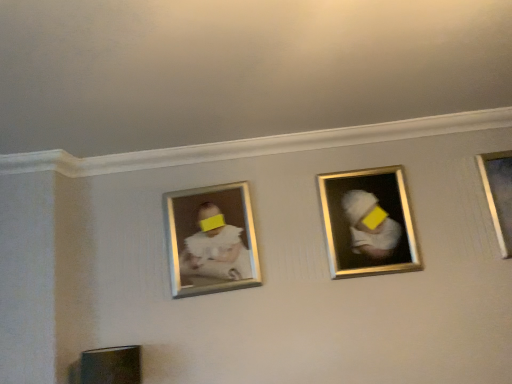
What is the approximate height of metallic silver picture frame at right, arranged as the second picture frame when viewed from the left?

23.09 inches.

What do you see at coordinates (215, 248) in the screenshot? This screenshot has height=384, width=512. I see `white matte baby portrait at center` at bounding box center [215, 248].

Identify the location of gold metallic picture frame at center, the 2th picture frame in the right-to-left sequence. (368, 222).

Can you see white matte baby portrait at center touching metallic silver picture frame at right, arranged as the second picture frame when viewed from the left?

No, white matte baby portrait at center is not beside metallic silver picture frame at right, arranged as the second picture frame when viewed from the left.

Is white matte baby portrait at center looking in the opposite direction of metallic silver picture frame at right, arranged as the second picture frame when viewed from the left?

No, metallic silver picture frame at right, arranged as the second picture frame when viewed from the left, is not at the back of white matte baby portrait at center.

Does white matte baby portrait at center have a smaller size compared to metallic silver picture frame at right, arranged as the second picture frame when viewed from the left?

No, white matte baby portrait at center is not smaller than metallic silver picture frame at right, arranged as the second picture frame when viewed from the left.

From a real-world perspective, relative to metallic silver picture frame at right, arranged as the second picture frame when viewed from the left, is white matte baby portrait at center vertically above or below?

From a real-world perspective, white matte baby portrait at center is physically above metallic silver picture frame at right, arranged as the second picture frame when viewed from the left.

From the image's perspective, which is below, gold metallic picture frame at center, the 2th picture frame in the right-to-left sequence, or metallic silver picture frame at right, arranged as the second picture frame when viewed from the left?

gold metallic picture frame at center, the 2th picture frame in the right-to-left sequence, is shown below in the image.

Consider the image. Considering the sizes of objects gold metallic picture frame at center, arranged as the 1th picture frame when viewed from the left, and metallic silver picture frame at right, arranged as the second picture frame when viewed from the left, in the image provided, who is wider, gold metallic picture frame at center, arranged as the 1th picture frame when viewed from the left, or metallic silver picture frame at right, arranged as the second picture frame when viewed from the left,?

Wider between the two is gold metallic picture frame at center, arranged as the 1th picture frame when viewed from the left.

From a real-world perspective, which object rests below the other?

gold metallic picture frame at center, the 2th picture frame in the right-to-left sequence, from a real-world perspective.

From a real-world perspective, between gold metallic picture frame at center, the 2th picture frame in the right-to-left sequence, and white matte baby portrait at center, who is vertically lower?

From a 3D spatial view, gold metallic picture frame at center, the 2th picture frame in the right-to-left sequence, is below.

Which is correct: gold metallic picture frame at center, the 2th picture frame in the right-to-left sequence, is inside white matte baby portrait at center, or outside of it?

gold metallic picture frame at center, the 2th picture frame in the right-to-left sequence, cannot be found inside white matte baby portrait at center.

From the image's perspective, between gold metallic picture frame at center, the 2th picture frame in the right-to-left sequence, and white matte baby portrait at center, who is located below?

From the image's view, white matte baby portrait at center is below.

Looking at the image, does gold metallic picture frame at center, the 2th picture frame in the right-to-left sequence, seem bigger or smaller compared to white matte baby portrait at center?

In the image, gold metallic picture frame at center, the 2th picture frame in the right-to-left sequence, appears to be larger than white matte baby portrait at center.

Is metallic silver picture frame at right, arranged as the second picture frame when viewed from the left, facing towards gold metallic picture frame at center, the 2th picture frame in the right-to-left sequence?

No.

From a real-world perspective, which is physically below, metallic silver picture frame at right, positioned as the first picture frame in right-to-left order, or gold metallic picture frame at center, arranged as the 1th picture frame when viewed from the left?

gold metallic picture frame at center, arranged as the 1th picture frame when viewed from the left, is physically lower.

Is metallic silver picture frame at right, arranged as the second picture frame when viewed from the left, beside gold metallic picture frame at center, arranged as the 1th picture frame when viewed from the left?

metallic silver picture frame at right, arranged as the second picture frame when viewed from the left, is not next to gold metallic picture frame at center, arranged as the 1th picture frame when viewed from the left, and they're not touching.

Who is taller, metallic silver picture frame at right, positioned as the first picture frame in right-to-left order, or gold metallic picture frame at center, arranged as the 1th picture frame when viewed from the left?

Standing taller between the two is gold metallic picture frame at center, arranged as the 1th picture frame when viewed from the left.

This screenshot has width=512, height=384. There is a white matte baby portrait at center. In order to click on the 1st picture frame above it (from the image's perspective) in this screenshot , I will do `click(368, 222)`.

From a real-world perspective, is white matte baby portrait at center positioned above or below gold metallic picture frame at center, the 2th picture frame in the right-to-left sequence?

In terms of real-world spatial position, white matte baby portrait at center is above gold metallic picture frame at center, the 2th picture frame in the right-to-left sequence.

Is white matte baby portrait at center facing away from gold metallic picture frame at center, the 2th picture frame in the right-to-left sequence?

No, gold metallic picture frame at center, the 2th picture frame in the right-to-left sequence, is not at the back of white matte baby portrait at center.

Is point (211, 257) more distant than point (404, 207)?

No, it is not.

Is metallic silver picture frame at right, arranged as the second picture frame when viewed from the left, located outside white matte baby portrait at center?

Indeed, metallic silver picture frame at right, arranged as the second picture frame when viewed from the left, is completely outside white matte baby portrait at center.

What's the angular difference between metallic silver picture frame at right, positioned as the first picture frame in right-to-left order, and white matte baby portrait at center's facing directions?

They differ by 3.79 degrees in their facing directions.

Does metallic silver picture frame at right, positioned as the first picture frame in right-to-left order, have a greater width compared to white matte baby portrait at center?

No, metallic silver picture frame at right, positioned as the first picture frame in right-to-left order, is not wider than white matte baby portrait at center.

Is metallic silver picture frame at right, positioned as the first picture frame in right-to-left order, oriented towards white matte baby portrait at center?

No, metallic silver picture frame at right, positioned as the first picture frame in right-to-left order, is not facing towards white matte baby portrait at center.

Find the location of a particular element. This screenshot has width=512, height=384. person above the metallic silver picture frame at right, positioned as the first picture frame in right-to-left order (from a real-world perspective) is located at coordinates (215, 248).

Where is `picture frame that is below the metallic silver picture frame at right, positioned as the first picture frame in right-to-left order (from the image's perspective)`? picture frame that is below the metallic silver picture frame at right, positioned as the first picture frame in right-to-left order (from the image's perspective) is located at coordinates (368, 222).

From the image, which object appears to be nearer to gold metallic picture frame at center, arranged as the 1th picture frame when viewed from the left, white matte baby portrait at center or metallic silver picture frame at right, arranged as the second picture frame when viewed from the left?

metallic silver picture frame at right, arranged as the second picture frame when viewed from the left, is positioned closer to the anchor gold metallic picture frame at center, arranged as the 1th picture frame when viewed from the left.

Estimate the real-world distances between objects in this image. Which object is closer to gold metallic picture frame at center, the 2th picture frame in the right-to-left sequence, metallic silver picture frame at right, arranged as the second picture frame when viewed from the left, or white matte baby portrait at center?

metallic silver picture frame at right, arranged as the second picture frame when viewed from the left, lies closer to gold metallic picture frame at center, the 2th picture frame in the right-to-left sequence, than the other object.

Which object lies nearer to the anchor point metallic silver picture frame at right, positioned as the first picture frame in right-to-left order, white matte baby portrait at center or gold metallic picture frame at center, arranged as the 1th picture frame when viewed from the left?

gold metallic picture frame at center, arranged as the 1th picture frame when viewed from the left, is positioned closer to the anchor metallic silver picture frame at right, positioned as the first picture frame in right-to-left order.

Which object lies further to the anchor point white matte baby portrait at center, metallic silver picture frame at right, arranged as the second picture frame when viewed from the left, or gold metallic picture frame at center, the 2th picture frame in the right-to-left sequence?

metallic silver picture frame at right, arranged as the second picture frame when viewed from the left, is positioned further to the anchor white matte baby portrait at center.

Estimate the real-world distances between objects in this image. Which object is closer to metallic silver picture frame at right, arranged as the second picture frame when viewed from the left, gold metallic picture frame at center, the 2th picture frame in the right-to-left sequence, or white matte baby portrait at center?

gold metallic picture frame at center, the 2th picture frame in the right-to-left sequence, is positioned closer to the anchor metallic silver picture frame at right, arranged as the second picture frame when viewed from the left.

Considering their positions, is gold metallic picture frame at center, arranged as the 1th picture frame when viewed from the left, positioned further to white matte baby portrait at center than metallic silver picture frame at right, positioned as the first picture frame in right-to-left order?

The object further to white matte baby portrait at center is metallic silver picture frame at right, positioned as the first picture frame in right-to-left order.

Find the location of a particular element. This screenshot has height=384, width=512. picture frame between white matte baby portrait at center and metallic silver picture frame at right, positioned as the first picture frame in right-to-left order, in the horizontal direction is located at coordinates (368, 222).